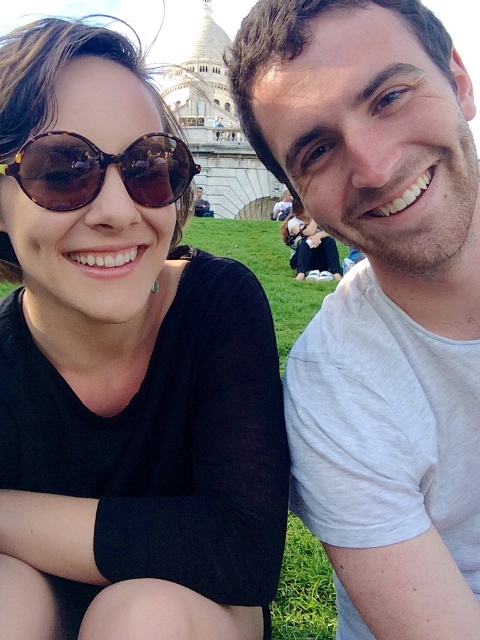
You are standing in the grassy area and want to walk towards the two people sitting close together. Which of the two points, point (12, 193) or point (228, 136), would you reach first?

Point (12, 193) is closer to the viewer than point (228, 136), so you would reach point (12, 193) first.